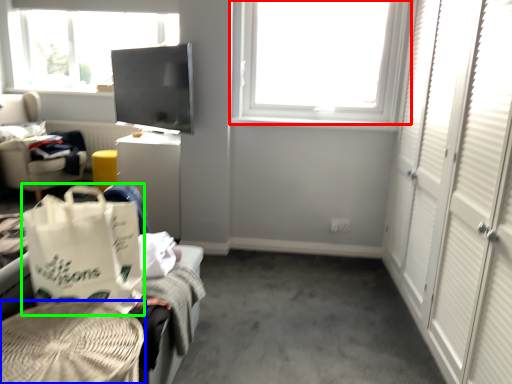
Question: Which object is the closest to the window (highlighted by a red box)? Choose among these: furniture (highlighted by a blue box) or shopping bag (highlighted by a green box).

Choices:
 (A) furniture
 (B) shopping bag

Answer: (B)